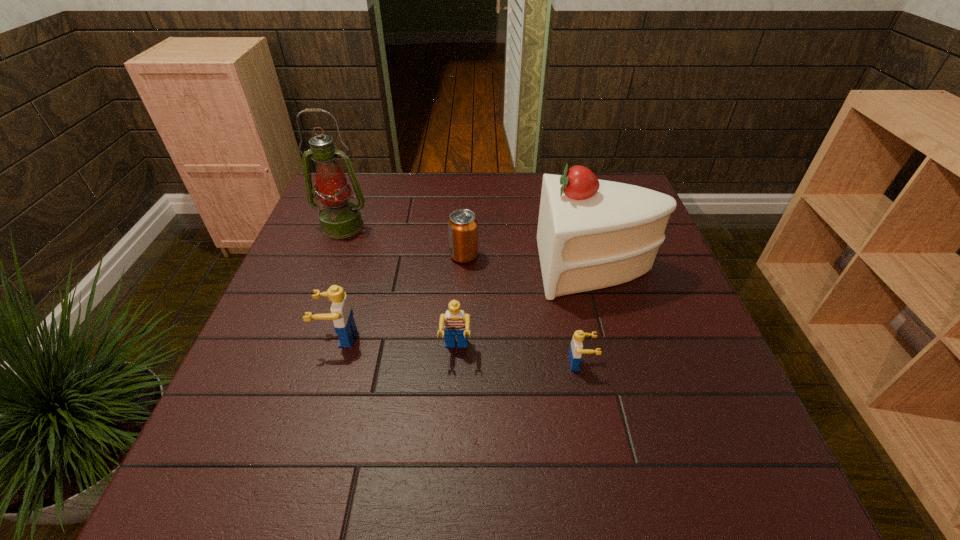
Locate an element on the screen. This screenshot has width=960, height=540. vacant position at the far edge of the desktop is located at coordinates (403, 174).

Where is `free space at the near edge`? The height and width of the screenshot is (540, 960). free space at the near edge is located at coordinates (456, 402).

Find the location of a particular element. This screenshot has width=960, height=540. free region at the left edge is located at coordinates (306, 355).

In the image, there is a desktop. Identify the location of vacant space at the right edge. (666, 288).

The width and height of the screenshot is (960, 540). Find the location of `free space at the far left corner`. free space at the far left corner is located at coordinates (369, 182).

Find the location of a particular element. This screenshot has height=540, width=960. free space between the shortest object and the second tallest Lego is located at coordinates (518, 356).

Identify the location of empty space that is in between the rightmost Lego and the tallest object. (462, 295).

At what (x,y) coordinates should I click in order to perform the action: click on vacant space that's between the third tallest object and the tallest object. Please return your answer as a coordinate pair (x, y). The width and height of the screenshot is (960, 540). Looking at the image, I should click on [x=341, y=281].

Find the location of a particular element. The width and height of the screenshot is (960, 540). empty location between the shortest object and the soda can is located at coordinates (522, 309).

Where is `vacant space that's between the cake and the soda can`? The height and width of the screenshot is (540, 960). vacant space that's between the cake and the soda can is located at coordinates (531, 261).